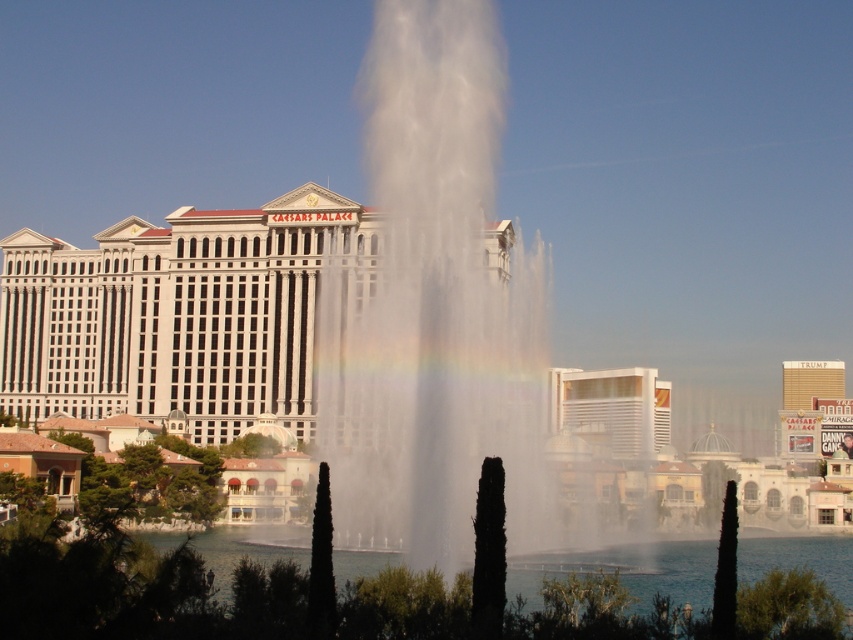
Based on the photo, you are standing at the edge of the Bellagio fountain and want to throw a small paper boat into the water near the white glossy hotel at center. The boat can only float if it stays within 15 meters of the hotel. Can you determine if the white frothy water at center is within the safe floating distance?

The white frothy water at center is 16.49 meters from the white glossy hotel at center, which is beyond the 15 meters safe floating distance. Therefore, the boat cannot float safely there.

You are standing at the entrance of Caesars Palace and want to locate the point marked at coordinates (x=434, y=308). According to the scene description, where exactly would this point be located?

The point marked at coordinates (x=434, y=308) is located on the white frothy water at center.

You are standing at the camera position and want to reach the point at coordinates (424,492). Given that your walking speed is 1.5 meters per second, how many seconds will it take you to reach that point?

The point at coordinates (424,492) is 82.84 meters away from the camera. At a walking speed of 1.5 meters per second, it would take approximately 55.23 seconds to reach that point.